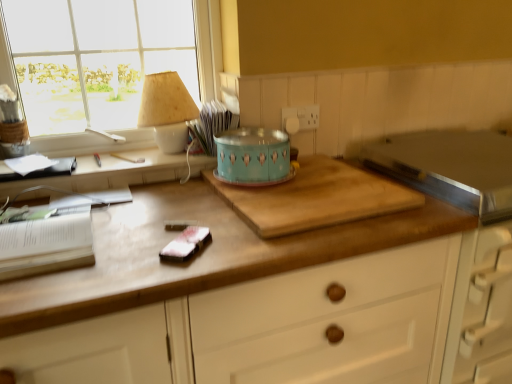
What is the approximate width of wooden cutting board at center?

It is 24.72 inches.

What is the approximate width of wooden desk at lower left?

wooden desk at lower left is 9.09 inches wide.

Measure the distance between wooden desk at lower left and camera.

The distance of wooden desk at lower left from camera is 3.91 feet.

Where is `clear glass window at upper left`? clear glass window at upper left is located at coordinates (105, 63).

You are a GUI agent. You are given a task and a screenshot of the screen. Output one action in this format:
    pyautogui.click(x=<x>, y=<y>)
    Task: Click on the table lamp above the wooden cutting board at center (from the image's perspective)
    This screenshot has width=512, height=384.
    Given the screenshot: What is the action you would take?
    pyautogui.click(x=167, y=110)

Based on the photo, looking at the image, does wooden cutting board at center seem bigger or smaller compared to matte beige lampshade at upper left?

Considering their sizes, wooden cutting board at center takes up more space than matte beige lampshade at upper left.

Is wooden cutting board at center directly adjacent to matte beige lampshade at upper left?

No.

Can you confirm if wooden cutting board at center is positioned to the right of matte beige lampshade at upper left?

Yes.

From the image's perspective, is stainless steel toaster at upper right, the 1th appliance from the right, located above or below matte beige lampshade at upper left?

stainless steel toaster at upper right, the 1th appliance from the right, is below matte beige lampshade at upper left.

Can you see stainless steel toaster at upper right, the 1th appliance from the right, touching matte beige lampshade at upper left?

No, stainless steel toaster at upper right, the 1th appliance from the right, is not next to matte beige lampshade at upper left.

This screenshot has height=384, width=512. Identify the location of table lamp above the stainless steel toaster at upper right, the 1th appliance from the right (from the image's perspective). (167, 110).

Considering the relative sizes of stainless steel toaster at upper right, the 1th appliance from the right, and matte beige lampshade at upper left in the image provided, is stainless steel toaster at upper right, the 1th appliance from the right, smaller than matte beige lampshade at upper left?

No.

Is teal glossy cake tin at center, which is counted as the second appliance, starting from the right, at the right side of wooden cutting board at center?

Indeed, teal glossy cake tin at center, which is counted as the second appliance, starting from the right, is positioned on the right side of wooden cutting board at center.

Is teal glossy cake tin at center, the first appliance positioned from the left, wider than wooden cutting board at center?

In fact, teal glossy cake tin at center, the first appliance positioned from the left, might be narrower than wooden cutting board at center.

Does teal glossy cake tin at center, the first appliance positioned from the left, contain wooden cutting board at center?

Definitely not — wooden cutting board at center is not inside teal glossy cake tin at center, the first appliance positioned from the left.

Which is farther from the camera, (233, 159) or (77, 318)?

The point (233, 159) is farther from the camera.

Is wooden desk at lower left to the right of teal glossy cake tin at center, the first appliance positioned from the left, from the viewer's perspective?

No.

Is wooden desk at lower left spatially inside teal glossy cake tin at center, the first appliance positioned from the left, or outside of it?

wooden desk at lower left is spatially situated outside teal glossy cake tin at center, the first appliance positioned from the left.

Which of these two, wooden desk at lower left or teal glossy cake tin at center, which is counted as the second appliance, starting from the right, is wider?

teal glossy cake tin at center, which is counted as the second appliance, starting from the right.

Is wooden desk at lower left with teal glossy cake tin at center, which is counted as the second appliance, starting from the right?

wooden desk at lower left and teal glossy cake tin at center, which is counted as the second appliance, starting from the right, are clearly separated.

Does stainless steel toaster at upper right, the 1th appliance from the right, have a smaller size compared to wooden cutting board at center?

No, stainless steel toaster at upper right, the 1th appliance from the right, is not smaller than wooden cutting board at center.

Do you think stainless steel toaster at upper right, the 2th appliance from the left, is within wooden cutting board at center, or outside of it?

The correct answer is: outside.

Does stainless steel toaster at upper right, the 2th appliance from the left, turn towards wooden cutting board at center?

No, stainless steel toaster at upper right, the 2th appliance from the left, does not turn towards wooden cutting board at center.

From a real-world perspective, who is located higher, stainless steel toaster at upper right, the 1th appliance from the right, or wooden cutting board at center?

stainless steel toaster at upper right, the 1th appliance from the right, is physically above.

From the image's perspective, is white paper book at left below wooden desk at lower left?

Correct, white paper book at left appears lower than wooden desk at lower left in the image.

Is white paper book at left next to wooden desk at lower left and touching it?

No, white paper book at left is not beside wooden desk at lower left.

Can you confirm if white paper book at left is taller than wooden desk at lower left?

Correct, white paper book at left is much taller as wooden desk at lower left.

From a real-world perspective, is white paper book at left positioned under wooden desk at lower left based on gravity?

Yes, from a real-world perspective, white paper book at left is under wooden desk at lower left.

Is point (187, 247) more distant than point (266, 189)?

No.

Is satin pink fabric at center located outside wooden cutting board at center?

Indeed, satin pink fabric at center is completely outside wooden cutting board at center.

Locate an element on the screen. This screenshot has height=384, width=512. countertop in front of the matte beige lampshade at upper left is located at coordinates (198, 254).

Where is `table lamp that appears behind the stainless steel toaster at upper right, the 2th appliance from the left`? table lamp that appears behind the stainless steel toaster at upper right, the 2th appliance from the left is located at coordinates (167, 110).

Consider the image. Based on their spatial positions, is teal glossy cake tin at center, the first appliance positioned from the left, or wooden desk at lower left closer to stainless steel toaster at upper right, the 1th appliance from the right?

Based on the image, teal glossy cake tin at center, the first appliance positioned from the left, appears to be nearer to stainless steel toaster at upper right, the 1th appliance from the right.

Considering their positions, is stainless steel toaster at upper right, the 1th appliance from the right, positioned further to wooden desk at lower left than clear glass window at upper left?

stainless steel toaster at upper right, the 1th appliance from the right, is positioned further to the anchor wooden desk at lower left.

Based on their spatial positions, is satin pink fabric at center or wooden cutting board at center further from matte beige lampshade at upper left?

Among the two, satin pink fabric at center is located further to matte beige lampshade at upper left.

Consider the image. Looking at the image, which one is located closer to wooden cutting board at center, clear glass window at upper left or stainless steel toaster at upper right, the 1th appliance from the right?

Result: The object closer to wooden cutting board at center is clear glass window at upper left.

Looking at the image, which one is located further to teal glossy cake tin at center, the first appliance positioned from the left, satin pink fabric at center or wooden desk at lower left?

satin pink fabric at center is further to teal glossy cake tin at center, the first appliance positioned from the left.

From the picture: Looking at the image, which one is located further to teal glossy cake tin at center, which is counted as the second appliance, starting from the right, matte beige lampshade at upper left or stainless steel toaster at upper right, the 1th appliance from the right?

stainless steel toaster at upper right, the 1th appliance from the right, lies further to teal glossy cake tin at center, which is counted as the second appliance, starting from the right, than the other object.

When comparing their distances from wooden cutting board at center, does clear glass window at upper left or matte beige lampshade at upper left seem closer?

matte beige lampshade at upper left lies closer to wooden cutting board at center than the other object.

Based on their spatial positions, is white paper book at left or teal glossy cake tin at center, the first appliance positioned from the left, closer to satin pink fabric at center?

Based on the image, white paper book at left appears to be nearer to satin pink fabric at center.

Where is `stationery between wooden desk at lower left and teal glossy cake tin at center, the first appliance positioned from the left, from left to right`? stationery between wooden desk at lower left and teal glossy cake tin at center, the first appliance positioned from the left, from left to right is located at coordinates (186, 244).

This screenshot has width=512, height=384. Find the location of `computer desk located between clear glass window at upper left and teal glossy cake tin at center, the first appliance positioned from the left, in the left-right direction`. computer desk located between clear glass window at upper left and teal glossy cake tin at center, the first appliance positioned from the left, in the left-right direction is located at coordinates (109, 173).

What are the coordinates of `computer desk located between clear glass window at upper left and stainless steel toaster at upper right, the 2th appliance from the left, in the left-right direction` in the screenshot? It's located at (109, 173).

Locate an element on the screen. table lamp situated between white paper book at left and wooden cutting board at center from left to right is located at coordinates coord(167,110).